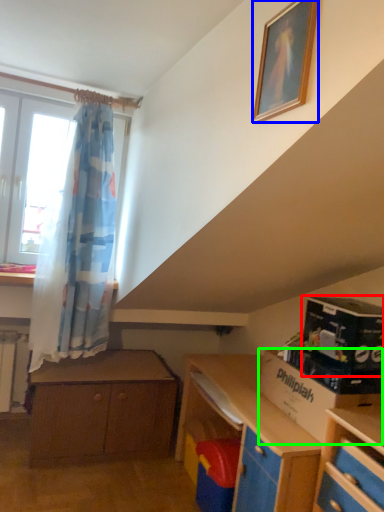
Question: Which object is the farthest from box (highlighted by a red box)? Choose among these: picture frame (highlighted by a blue box) or cardboard box (highlighted by a green box).

Choices:
 (A) picture frame
 (B) cardboard box

Answer: (A)